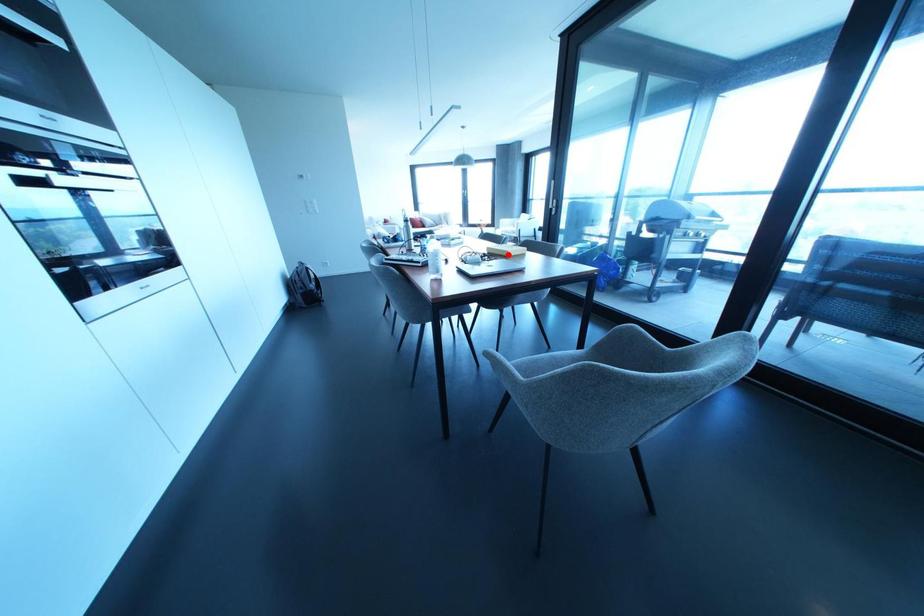
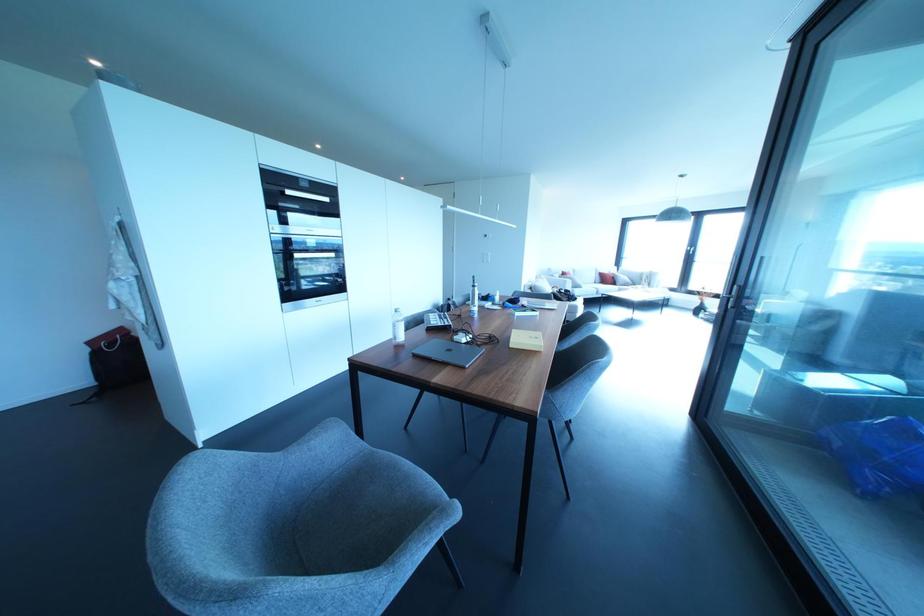
The point at the highlighted location is marked in the first image. Where is the corresponding point in the second image?

(511, 345)